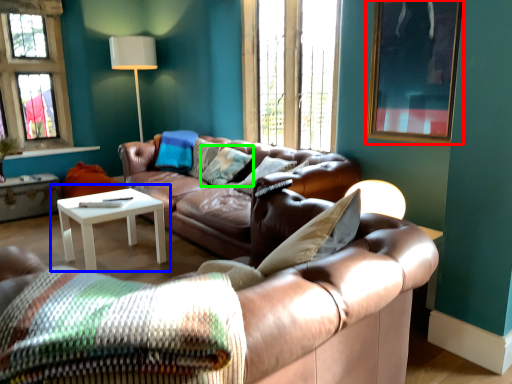
Question: Considering the real-world distances, which object is farthest from picture frame (highlighted by a red box)? coffee table (highlighted by a blue box) or pillow (highlighted by a green box)?

Choices:
 (A) coffee table
 (B) pillow

Answer: (A)